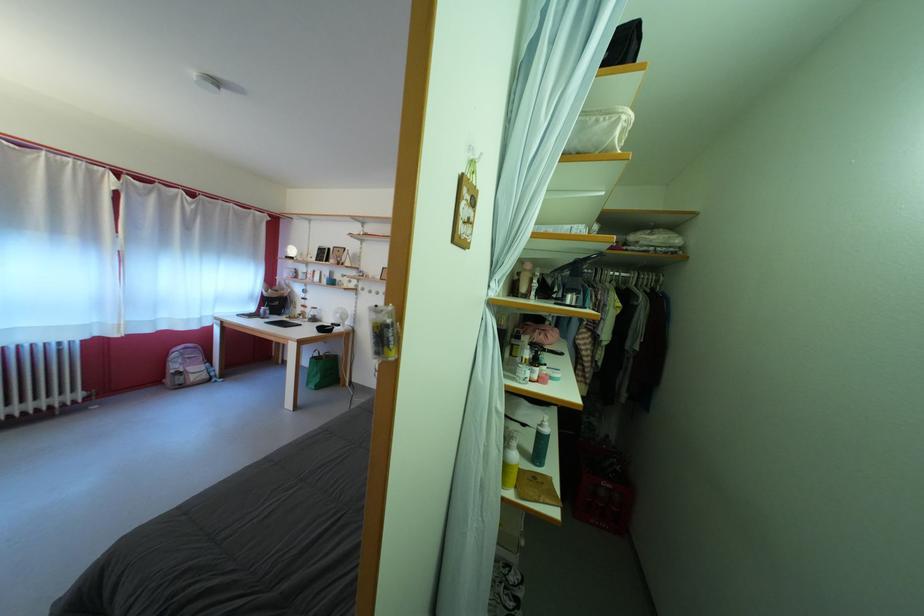
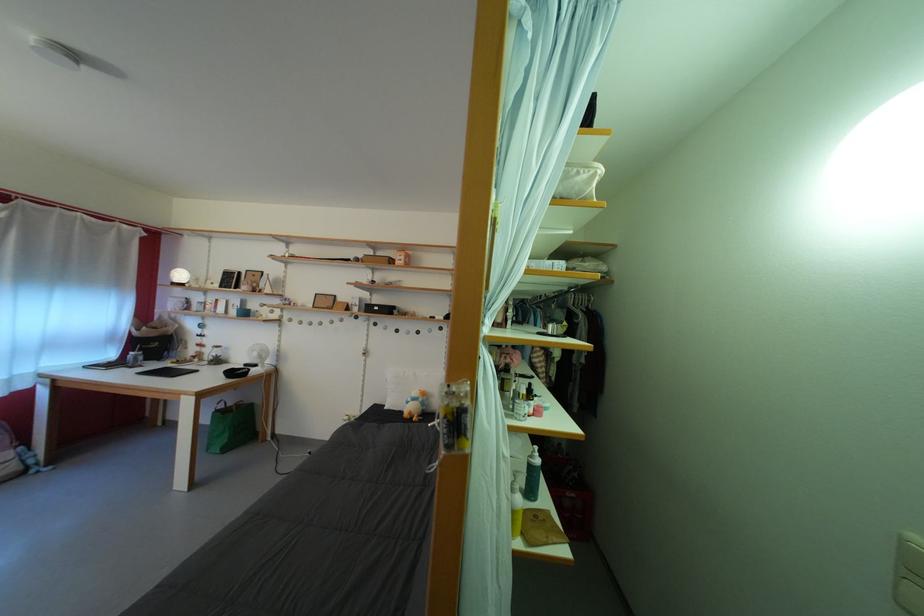
In the second image, find the point that corresponds to pixel 549 431 in the first image.

(540, 463)